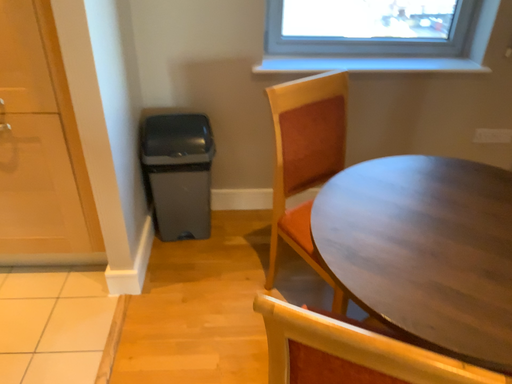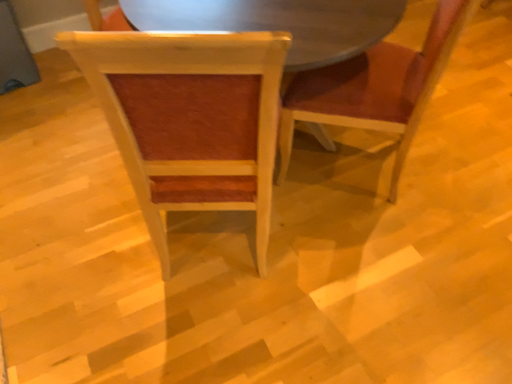
Question: How did the camera likely rotate when shooting the video?

Choices:
 (A) rotated downward
 (B) rotated upward

Answer: (A)